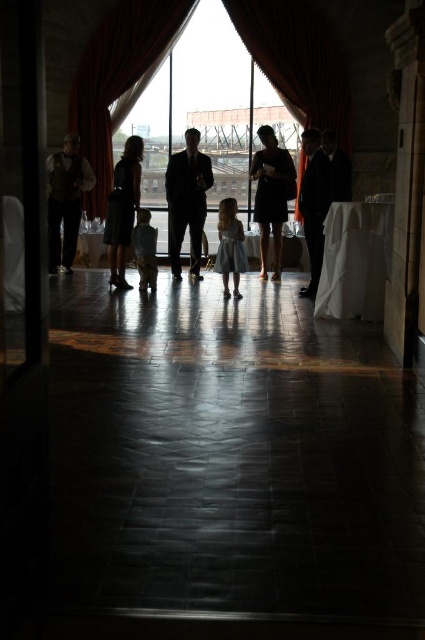
Is point (201, 211) closer to viewer compared to point (153, 289)?

No, (201, 211) is further to viewer.

Is silky black suit at center further to camera compared to light brown fabric child at center?

Yes, silky black suit at center is further from the viewer.

Who is more forward, (198, 177) or (150, 276)?

Point (150, 276) is in front.

This screenshot has height=640, width=425. Find the location of `silky black suit at center`. silky black suit at center is located at coordinates (187, 200).

Is matte gold vest at center closer to the viewer compared to silhouette dress at center?

No, matte gold vest at center is further to the viewer.

Who is shorter, matte gold vest at center or silhouette dress at center?

Standing shorter between the two is silhouette dress at center.

Who is more distant from viewer, (65, 170) or (107, 214)?

The point (65, 170) is more distant.

Find the location of `matte gold vest at center`. matte gold vest at center is located at coordinates (65, 200).

Does light blue satin dress at center have a larger size compared to light brown fabric child at center?

Indeed, light blue satin dress at center has a larger size compared to light brown fabric child at center.

Is point (226, 216) positioned in front of point (155, 236)?

Yes, it is.

Locate an element on the screen. light blue satin dress at center is located at coordinates (229, 246).